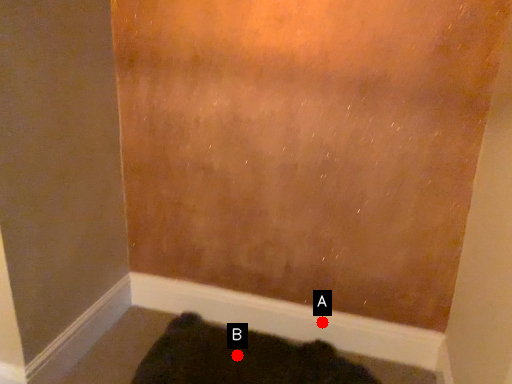
Question: Two points are circled on the image, labeled by A and B beside each circle. Which point is closer to the camera?

Choices:
 (A) A is closer
 (B) B is closer

Answer: (B)